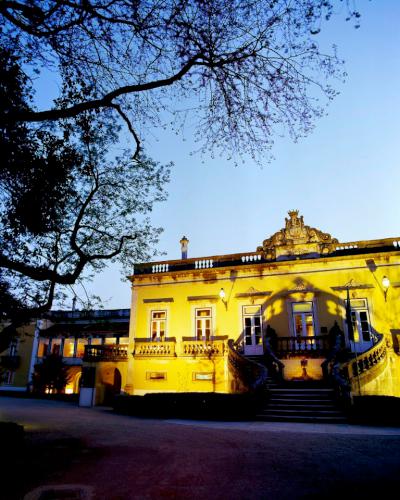
Find the location of a particular element. The height and width of the screenshot is (500, 400). 1 statue on staircase is located at coordinates (306, 369).